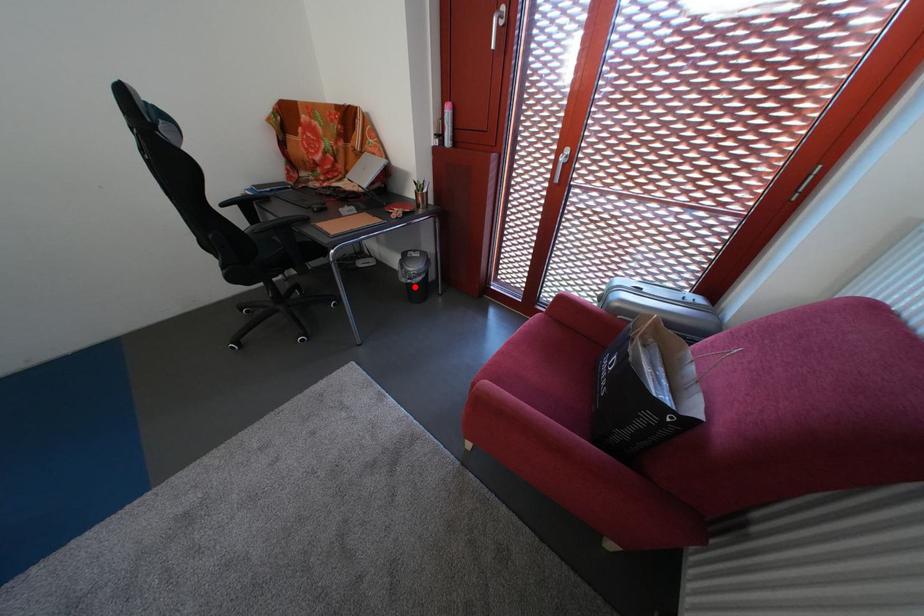
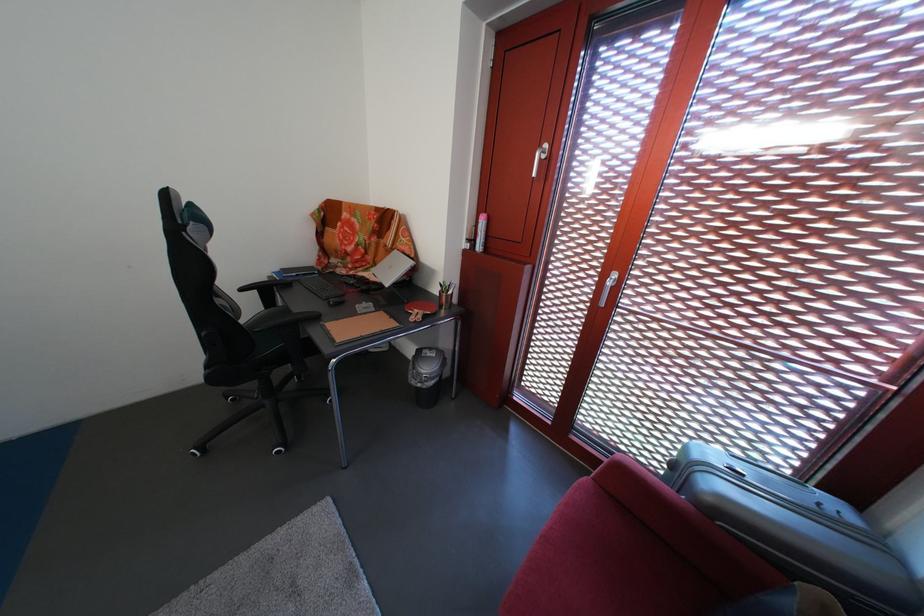
Question: I am providing you with two images of the same scene from different viewpoints. Image1 has a red point marked. In image2, the corresponding 3D location appears at what relative position? Reply with the corresponding letter.

Choices:
 (A) Closer
 (B) Farther

Answer: (B)